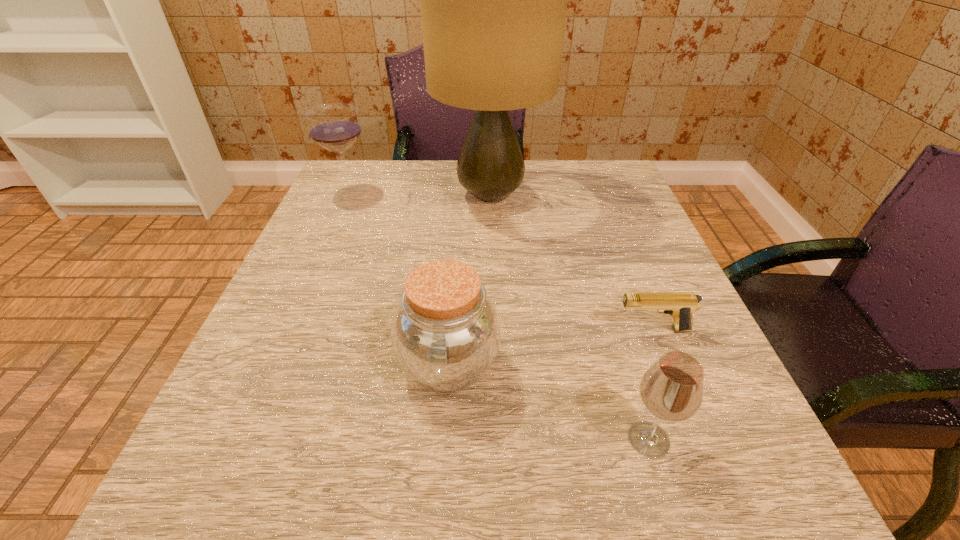
At what (x,y) coordinates should I click in order to perform the action: click on free space located 0.270m on the back of the shorter wineglass. Please return your answer as a coordinate pair (x, y). This screenshot has width=960, height=540. Looking at the image, I should click on (601, 285).

Image resolution: width=960 pixels, height=540 pixels. I want to click on vacant space located 0.390m at the barrel of the pistol, so click(379, 330).

Where is `vacant space positioned at the barrel of the pistol`? Image resolution: width=960 pixels, height=540 pixels. vacant space positioned at the barrel of the pistol is located at coordinates (549, 330).

Locate an element on the screen. vacant region located 0.190m at the barrel of the pistol is located at coordinates (500, 330).

Where is `lampshade that is at the far edge`? This screenshot has height=540, width=960. lampshade that is at the far edge is located at coordinates coord(493,0).

The width and height of the screenshot is (960, 540). Identify the location of wineglass situated at the far edge. (335, 127).

Find the location of a particular element. object located in the near edge section of the desktop is located at coordinates (672, 389).

You are a GUI agent. You are given a task and a screenshot of the screen. Output one action in this format:
    pyautogui.click(x=<x>, y=<y>)
    Task: Click on the object positioned at the left edge
    This screenshot has height=540, width=960.
    Given the screenshot: What is the action you would take?
    pyautogui.click(x=335, y=127)

The image size is (960, 540). What are the coordinates of `wineglass that is at the right edge` in the screenshot? It's located at (672, 389).

I want to click on pistol that is at the right edge, so click(680, 305).